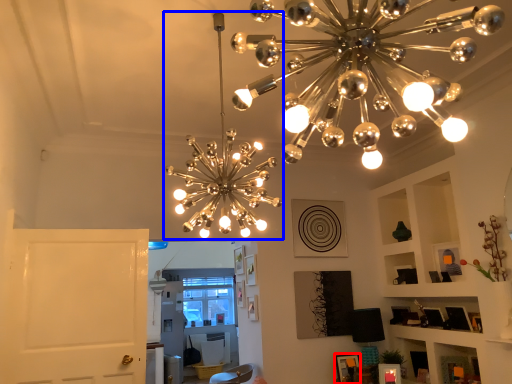
Question: Which point is further to the camera, picture frame (highlighted by a red box) or lamp (highlighted by a blue box)?

Choices:
 (A) picture frame
 (B) lamp

Answer: (A)